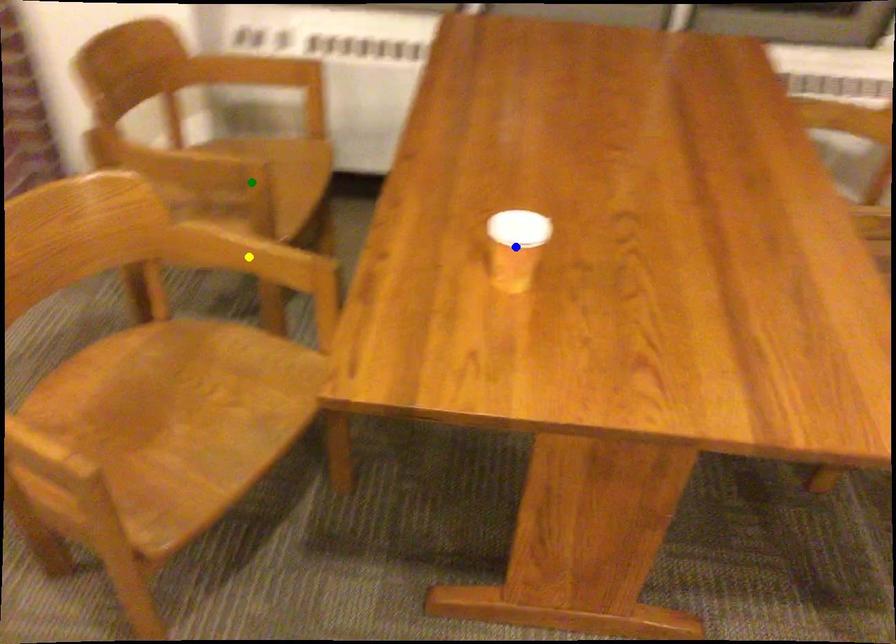
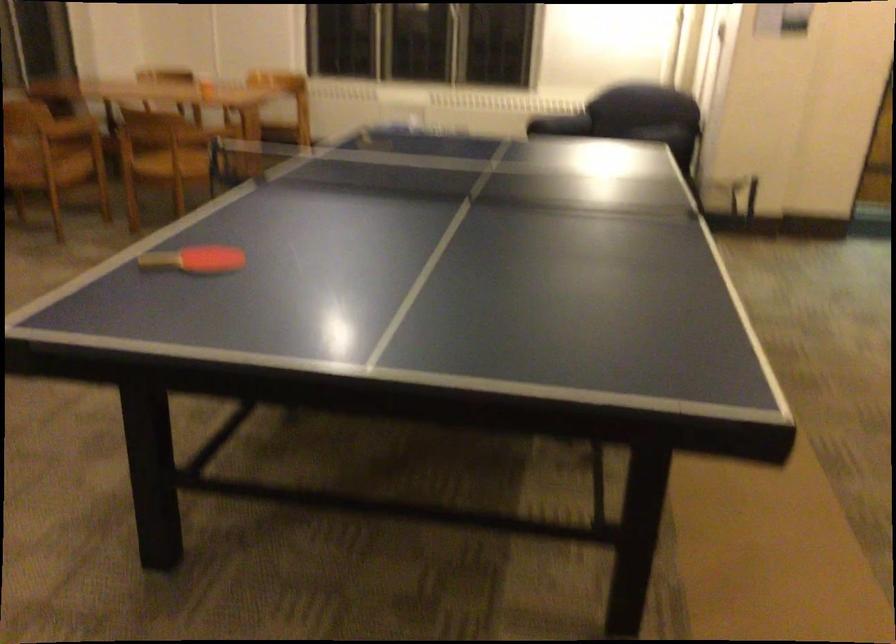
I am providing you with two images of the same scene from different viewpoints. Three points are marked in image1. Which point corresponds to a part or object that is occluded in image2?In image1, three points are marked. Which of them correspond to a part or object that is occluded in image2?Among the three points shown in image1, which one corresponds to a part or object that is no longer visible due to occlusion in image2?

Invisible in image2: blue point, yellow point, green point.